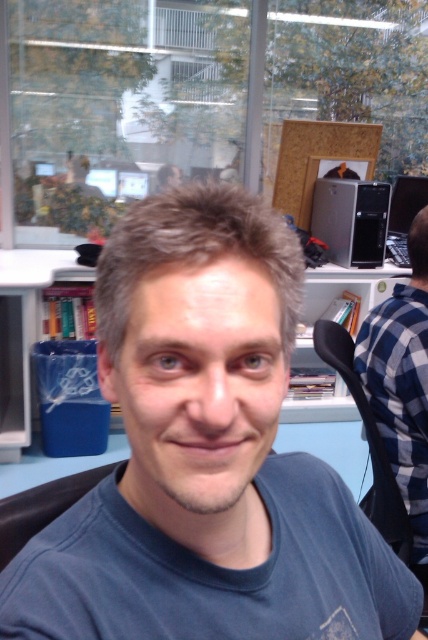
You are organizing items in the office and need to move the blue plastic bin at lower left. To access it, do you need to move the blue plaid shirt at right out of the way?

Yes, the blue plaid shirt at right is in front of the blue plastic bin at lower left, so you need to move it to access the bin.

You are organizing a small event in this workspace and need to place a decorative item between the blue plaid shirt at right and the blue plastic bin at lower left. Based on their positions, where should you place the item to ensure it is between them?

The blue plaid shirt at right is below the blue plastic bin at lower left, so placing the decorative item between them would require positioning it above the blue plaid shirt at right and below the blue plastic bin at lower left.

You are organizing a space and need to place a new item between the blue plastic bin at lower left and the satin black tower at upper right. Based on their positions, where should you place the new item to maintain the vertical arrangement?

The blue plastic bin at lower left is located below the satin black tower at upper right, so to maintain the vertical arrangement, place the new item between them along the vertical axis, ensuring it sits above the blue plastic bin at lower left and below the satin black tower at upper right.